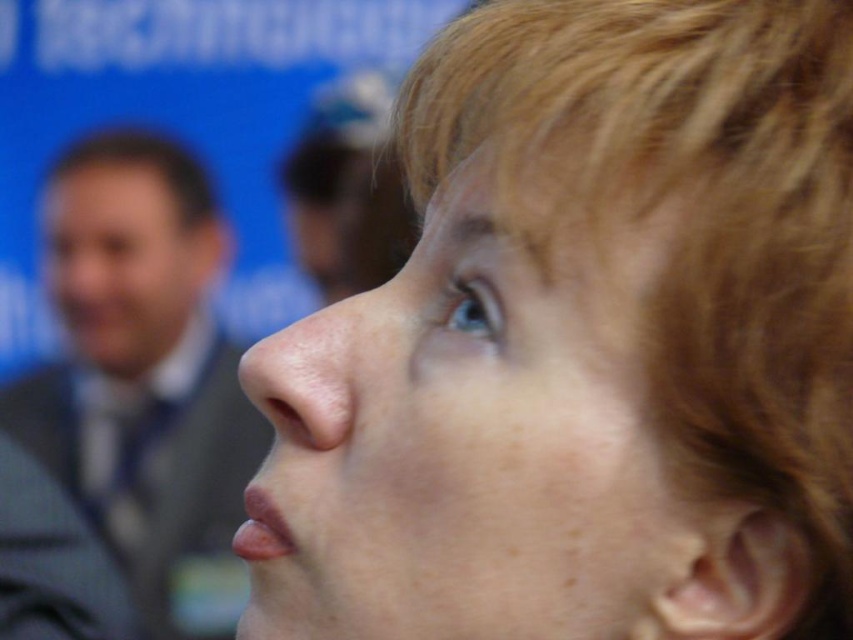
Question: Can you confirm if gray suit at left is thinner than brown matte hair at left?

Choices:
 (A) no
 (B) yes

Answer: (A)

Question: Does smooth skin face at center appear under gray suit at left?

Choices:
 (A) no
 (B) yes

Answer: (A)

Question: Based on their relative distances, which object is nearer to the gray suit at left?

Choices:
 (A) smooth skin face at center
 (B) matte gray suit at upper left
 (C) brown matte hair at left

Answer: (C)

Question: Which point is closer to the camera?

Choices:
 (A) brown matte hair at left
 (B) smooth skin face at center

Answer: (B)

Question: Is smooth skin face at center above brown matte hair at left?

Choices:
 (A) no
 (B) yes

Answer: (A)

Question: Which of these objects is positioned closest to the brown matte hair at left?

Choices:
 (A) gray suit at left
 (B) matte gray suit at upper left
 (C) smooth skin face at center

Answer: (A)